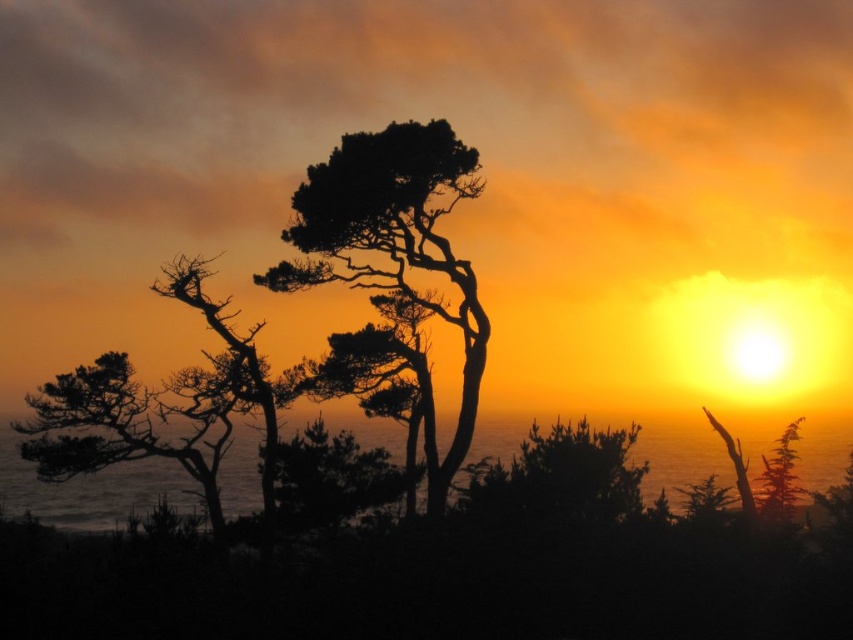
Question: Is silhouette bark tree at center closer to the viewer compared to transparent water at lower center?

Choices:
 (A) yes
 (B) no

Answer: (A)

Question: Is silhouette bark tree at center wider than transparent water at lower center?

Choices:
 (A) no
 (B) yes

Answer: (A)

Question: Where is silhouette bark tree at center located in relation to transparent water at lower center in the image?

Choices:
 (A) below
 (B) above

Answer: (B)

Question: Which object is farther from the camera taking this photo?

Choices:
 (A) transparent water at lower center
 (B) silhouette bark tree at center

Answer: (A)